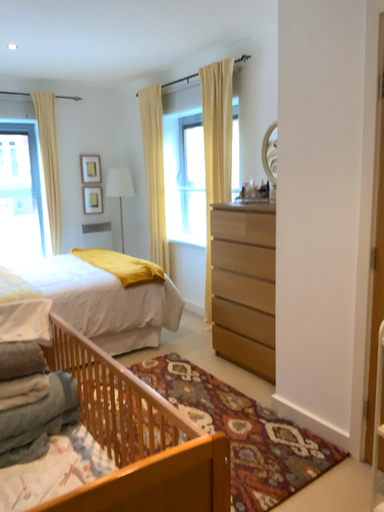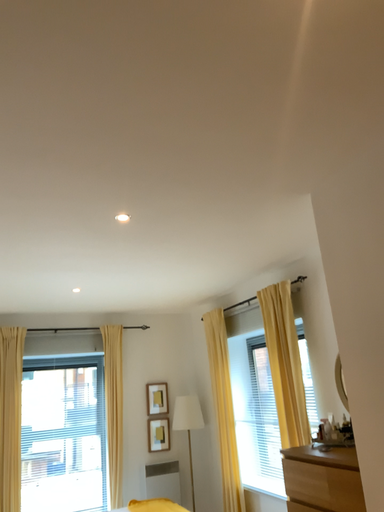
Question: Which way did the camera rotate in the video?

Choices:
 (A) rotated upward
 (B) rotated downward

Answer: (A)